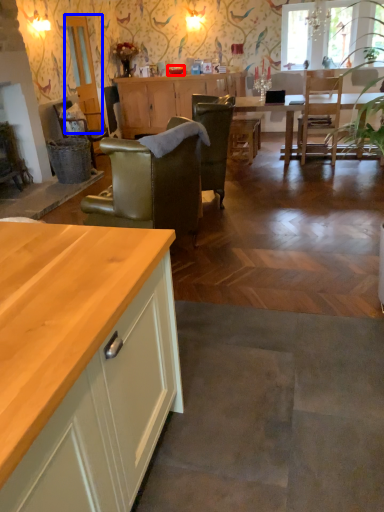
Question: Among these objects, which one is nearest to the camera, tableware (highlighted by a red box) or glass door (highlighted by a blue box)?

Choices:
 (A) tableware
 (B) glass door

Answer: (B)